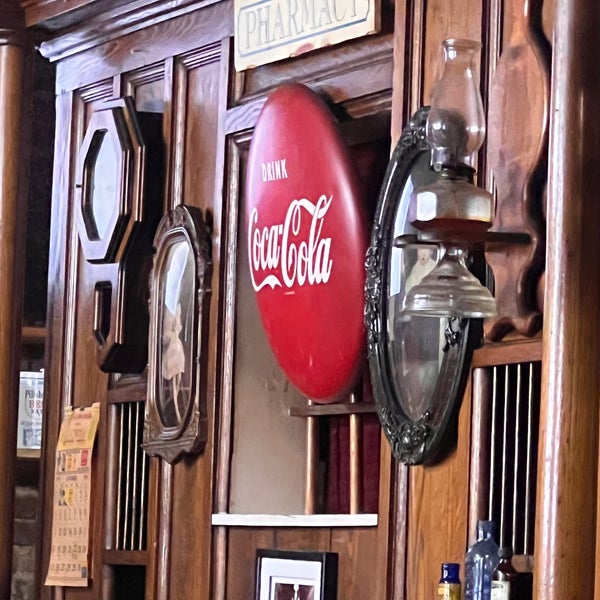
Locate an element on the screen. This screenshot has height=600, width=600. picture frame is located at coordinates (292, 555), (168, 442), (96, 247), (408, 440).